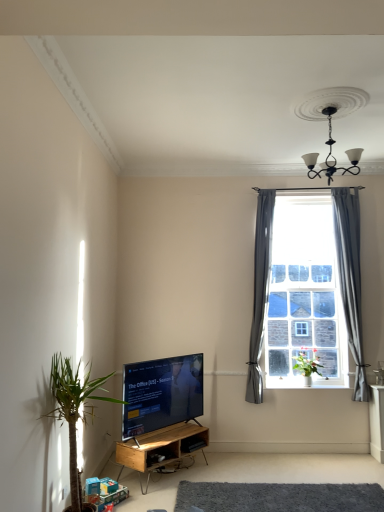
Question: Based on their positions, is green glossy plant at window, acting as the second houseplant starting from the left, located to the left or right of gray fabric curtain at right, which ranks as the first curtain in left-to-right order?

Choices:
 (A) right
 (B) left

Answer: (A)

Question: From a real-world perspective, is green glossy plant at window, arranged as the 2th houseplant when viewed from the front, positioned above or below gray fabric curtain at right, which ranks as the first curtain in left-to-right order?

Choices:
 (A) above
 (B) below

Answer: (B)

Question: Which is farther from the black wrought iron chandelier at upper right?

Choices:
 (A) green glossy plant at window, the 1th houseplant when ordered from back to front
 (B) gray carpet at lower center
 (C) clear glass window at center
 (D) woodenmaterial/textureshelf at lower center
 (E) black glossy tv at lower center

Answer: (B)

Question: Which object is the closest to the green leafy plant at lower left, the 2th houseplant from the right?

Choices:
 (A) gray fabric curtain at right, which ranks as the 2th curtain in right-to-left order
 (B) gray carpet at lower center
 (C) woodenmaterial/textureshelf at lower center
 (D) gray fabric curtain at right, positioned as the second curtain in left-to-right order
 (E) black glossy tv at lower center

Answer: (C)